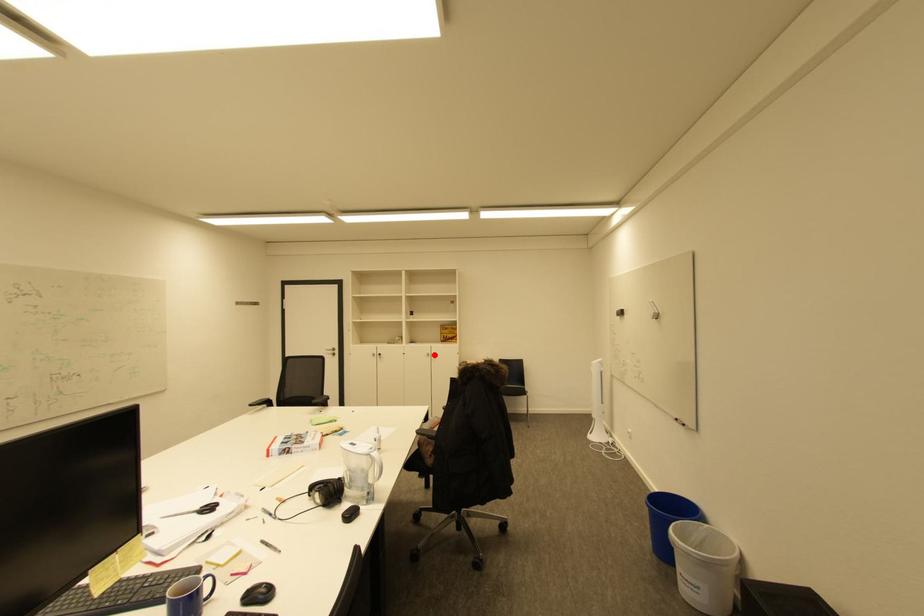
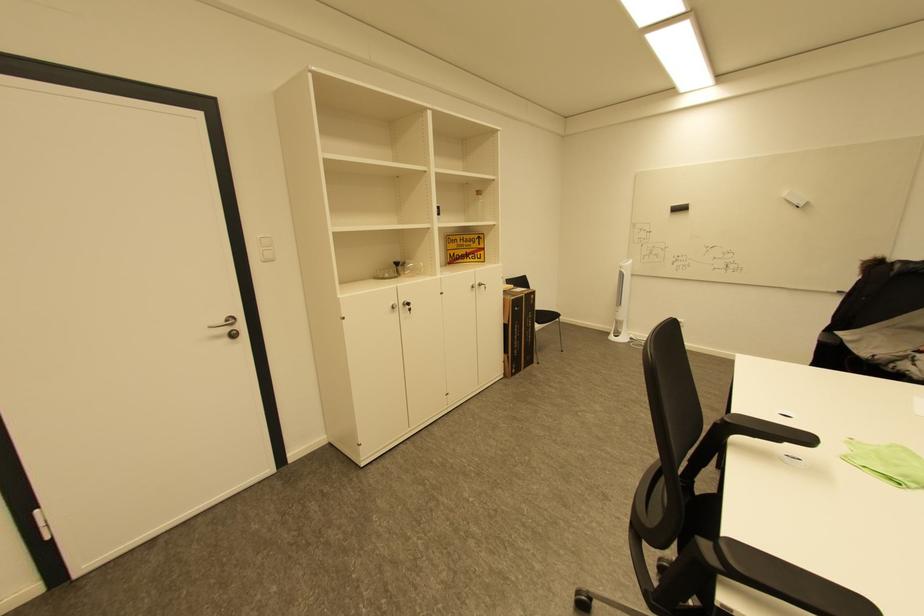
In the second image, find the point that corresponds to the highlighted location in the first image.

(479, 286)